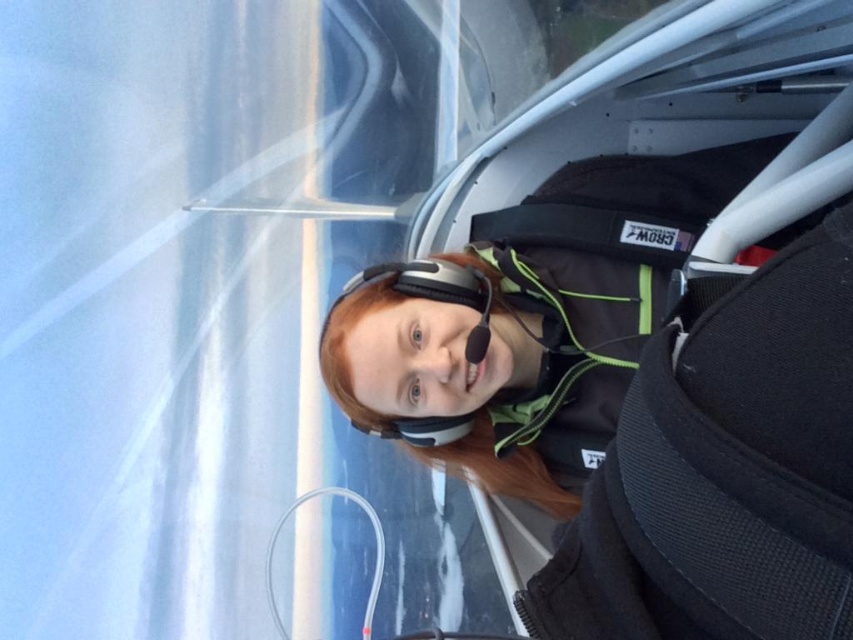
Question: Which point is closer to the camera taking this photo?

Choices:
 (A) (491, 296)
 (B) (587, 396)

Answer: (A)

Question: Can you confirm if black fabric strap at center is thinner than matte black earphone at center?

Choices:
 (A) no
 (B) yes

Answer: (A)

Question: Which of the following is the closest to the observer?

Choices:
 (A) (469, 296)
 (B) (601, 337)
 (C) (432, 289)

Answer: (C)

Question: In this image, where is black fabric strap at center located relative to matte black earphone at center?

Choices:
 (A) left
 (B) right

Answer: (B)

Question: Is transparent plastic goggles at center smaller than matte black earphone at center?

Choices:
 (A) yes
 (B) no

Answer: (B)

Question: Which point is farther to the camera?

Choices:
 (A) (535, 253)
 (B) (485, 298)

Answer: (A)